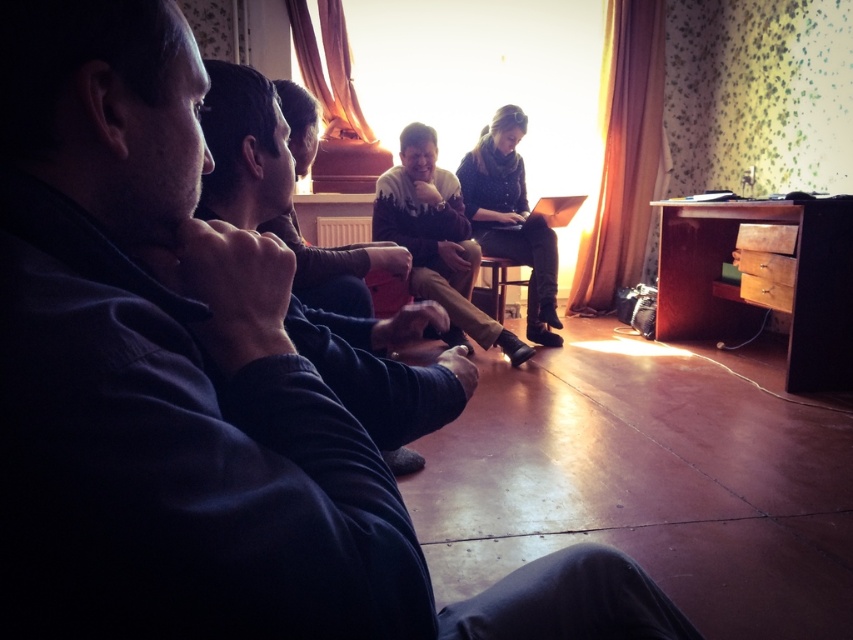
Which is in front, point (230, 113) or point (502, 259)?

Point (230, 113) is more forward.

Which is more to the left, dark blue sweater at center or wooden chair at center?

From the viewer's perspective, dark blue sweater at center appears more on the left side.

Which is in front, point (285, 173) or point (494, 282)?

Point (285, 173)

Find the location of a particular element. This screenshot has width=853, height=640. dark blue sweater at center is located at coordinates (244, 148).

Is dark brown leather jacket at center wider than wooden chair at center?

Yes.

Can you confirm if dark brown leather jacket at center is bigger than wooden chair at center?

Indeed, dark brown leather jacket at center has a larger size compared to wooden chair at center.

Is point (515, 125) positioned after point (482, 260)?

Yes, point (515, 125) is behind point (482, 260).

At what (x,y) coordinates should I click in order to perform the action: click on dark brown leather jacket at center. Please return your answer as a coordinate pair (x, y). Looking at the image, I should click on (511, 218).

Can you confirm if dark brown leather jacket at center is shorter than metallic gold laptop at center?

No, dark brown leather jacket at center is not shorter than metallic gold laptop at center.

Which of these two, dark brown leather jacket at center or metallic gold laptop at center, stands shorter?

Standing shorter between the two is metallic gold laptop at center.

Between point (529, 216) and point (549, 200), which one is positioned behind?

The point (529, 216) is more distant.

Identify the location of dark brown leather jacket at center. The width and height of the screenshot is (853, 640). (511, 218).